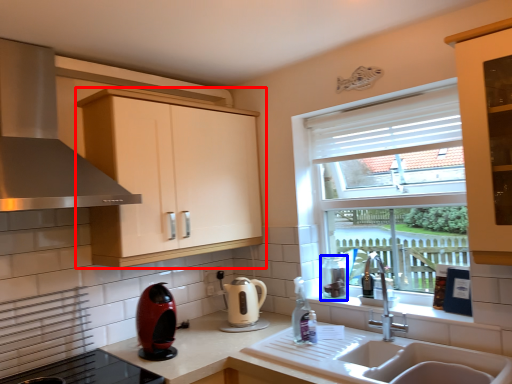
Question: Which point is further to the camera, cabinetry (highlighted by a red box) or appliance (highlighted by a blue box)?

Choices:
 (A) cabinetry
 (B) appliance

Answer: (B)